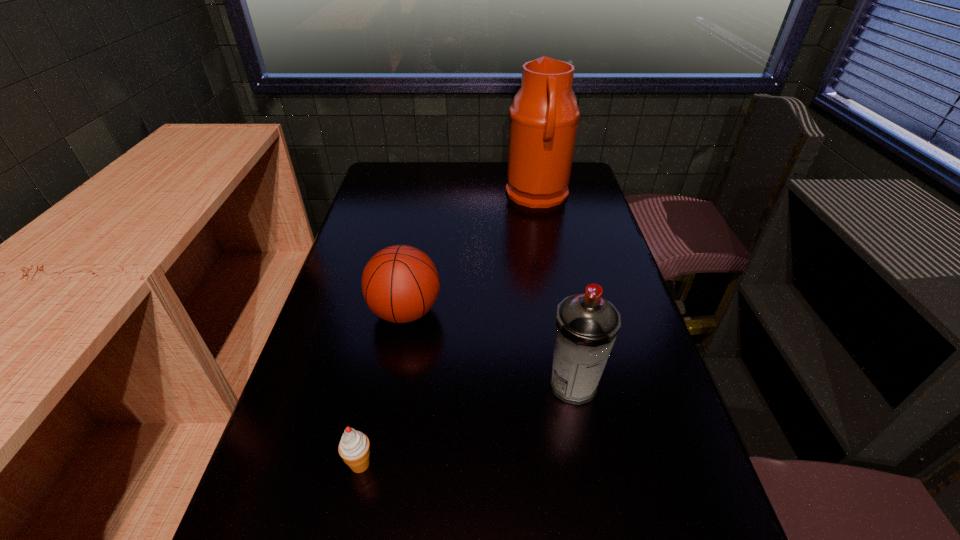
Locate an element on the screen. The width and height of the screenshot is (960, 540). water jug is located at coordinates (544, 115).

The width and height of the screenshot is (960, 540). Identify the location of the tallest object. (544, 115).

In order to click on the second tallest object in this screenshot , I will do `click(587, 325)`.

Identify the location of the second nearest object. tap(587, 325).

Identify the location of basketball. This screenshot has height=540, width=960. (400, 283).

Locate an element on the screen. This screenshot has height=540, width=960. the third tallest object is located at coordinates (400, 283).

Where is `the nearest object`? The width and height of the screenshot is (960, 540). the nearest object is located at coordinates (354, 448).

Locate an element on the screen. the shortest object is located at coordinates (354, 448).

At what (x,y) coordinates should I click in order to perform the action: click on blank area located 0.340m from the spout of the tallest object. Please return your answer as a coordinate pair (x, y). The width and height of the screenshot is (960, 540). Looking at the image, I should click on (411, 195).

This screenshot has height=540, width=960. I want to click on free region located 0.090m from the spout of the tallest object, so click(481, 195).